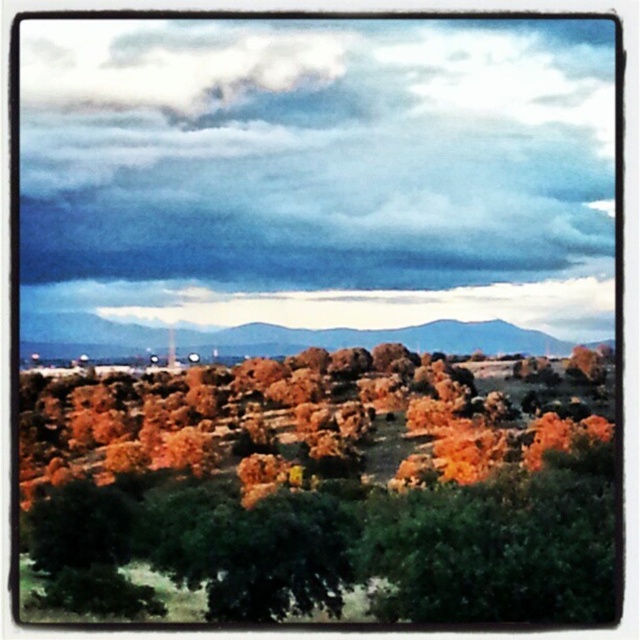
Question: Can you confirm if dark cloudy sky at upper center is positioned below brown rocky mountain at center?

Choices:
 (A) yes
 (B) no

Answer: (B)

Question: Which point is farther from the camera taking this photo?

Choices:
 (A) (580, 348)
 (B) (140, 176)

Answer: (B)

Question: Which of the following is the closest to the observer?

Choices:
 (A) (35, 339)
 (B) (403, 81)

Answer: (B)

Question: Which point is closer to the camera?

Choices:
 (A) [564, 304]
 (B) [76, 484]
 (C) [228, 330]

Answer: (B)

Question: Does dark cloudy sky at upper center appear over brown rocky mountain at center?

Choices:
 (A) yes
 (B) no

Answer: (A)

Question: From the image, what is the correct spatial relationship of orange leafy tree at center in relation to brown rocky mountain at center?

Choices:
 (A) left
 (B) right

Answer: (A)